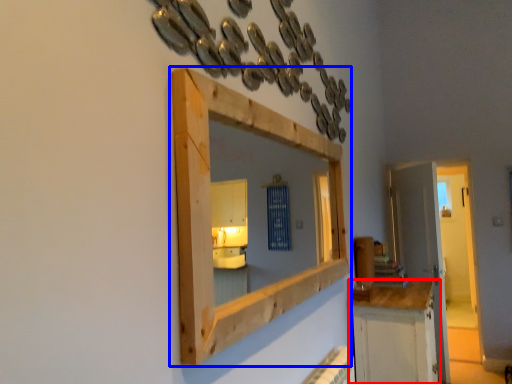
Question: Which of the following is the farthest to the observer, cabinetry (highlighted by a red box) or medicine cabinet (highlighted by a blue box)?

Choices:
 (A) cabinetry
 (B) medicine cabinet

Answer: (A)